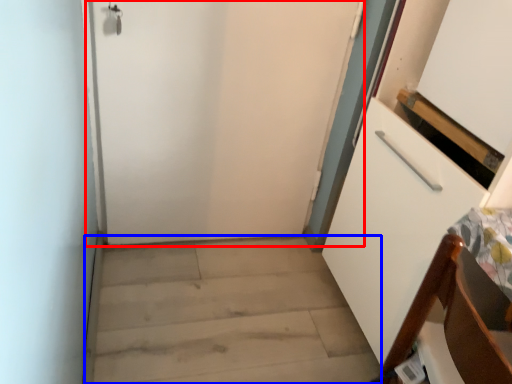
Question: Which object is further to the camera taking this photo, door (highlighted by a red box) or stairwell (highlighted by a blue box)?

Choices:
 (A) door
 (B) stairwell

Answer: (A)